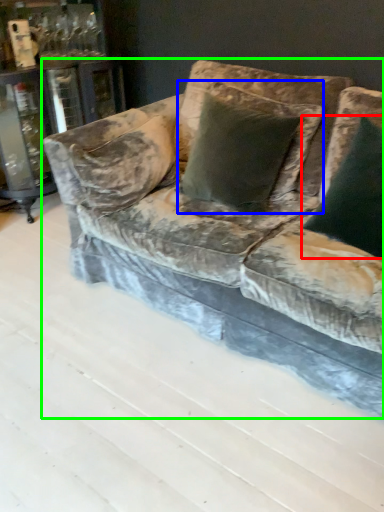
Question: Which object is positioned farthest from pillow (highlighted by a red box)? Select from pillow (highlighted by a blue box) and studio couch (highlighted by a green box).

Choices:
 (A) pillow
 (B) studio couch

Answer: (B)